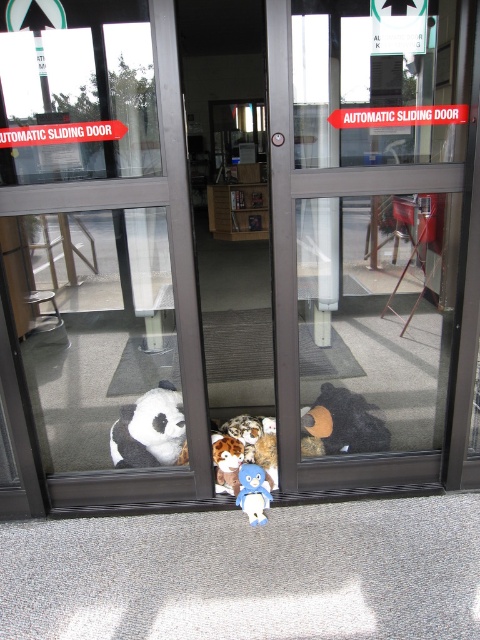
Question: Can you confirm if white plush at lower left is thinner than fluffy plush bear at center?

Choices:
 (A) yes
 (B) no

Answer: (B)

Question: Observing the image, what is the correct spatial positioning of fluffy plush bear at center in reference to blue plush toy at center?

Choices:
 (A) right
 (B) left

Answer: (B)

Question: Is the position of white plush at lower left more distant than that of blue plush toy at center?

Choices:
 (A) no
 (B) yes

Answer: (B)

Question: Which of the following is the closest to the observer?

Choices:
 (A) fluffy plush bear at center
 (B) blue plush toy at center

Answer: (B)

Question: Estimate the real-world distances between objects in this image. Which object is farther from the blue plush toy at center?

Choices:
 (A) fluffy plush bear at center
 (B) white plush at lower left

Answer: (B)

Question: Which object is positioned farthest from the white plush at lower left?

Choices:
 (A) blue plush toy at center
 (B) fluffy plush bear at center

Answer: (A)